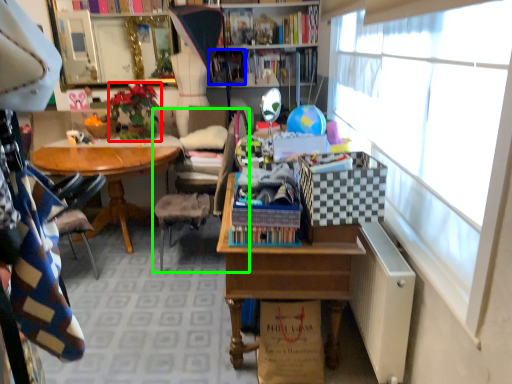
Question: Considering the real-world distances, which object is closest to houseplant (highlighted by a red box)? book (highlighted by a blue box) or chair (highlighted by a green box).

Choices:
 (A) book
 (B) chair

Answer: (B)